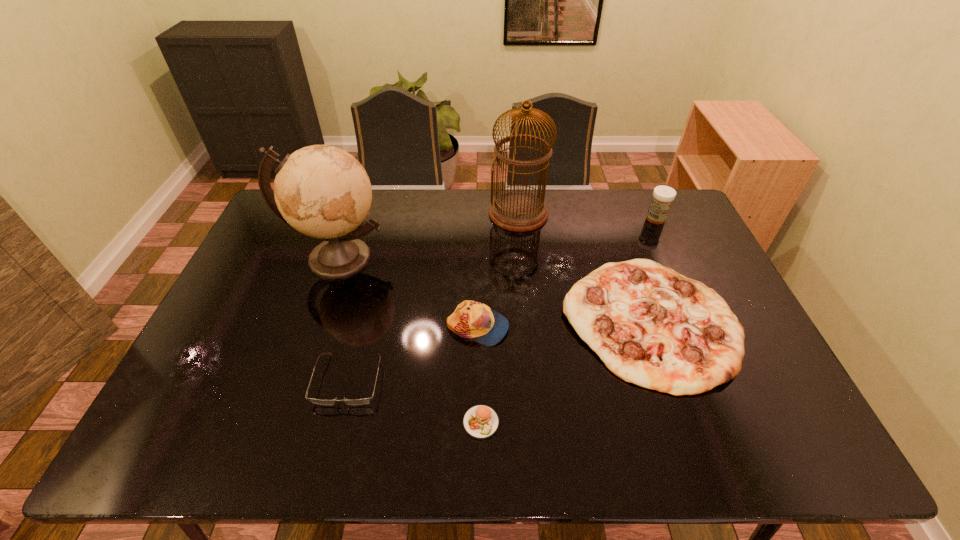
You are a GUI agent. You are given a task and a screenshot of the screen. Output one action in this format:
    pyautogui.click(x=<x>, y=<y>)
    Task: Click on the vacant space at the far edge of the desktop
    This screenshot has width=960, height=540.
    Given the screenshot: What is the action you would take?
    pyautogui.click(x=440, y=214)

The width and height of the screenshot is (960, 540). I want to click on vacant area at the near edge, so click(x=304, y=434).

Locate an element on the screen. This screenshot has height=540, width=960. vacant space at the left edge of the desktop is located at coordinates (249, 354).

This screenshot has width=960, height=540. In order to click on free space at the right edge in this screenshot , I will do `click(669, 268)`.

In the image, there is a desktop. Identify the location of free space at the near left corner. This screenshot has height=540, width=960. (150, 440).

This screenshot has height=540, width=960. Find the location of `vacant point at the far right corner`. vacant point at the far right corner is located at coordinates (638, 191).

Find the location of `free space at the near right corner of the desktop`. free space at the near right corner of the desktop is located at coordinates (777, 440).

At what (x,y) coordinates should I click in order to perform the action: click on empty space between the spectacles and the fifth tallest object. Please return your answer as a coordinate pair (x, y). This screenshot has width=960, height=540. Looking at the image, I should click on (499, 350).

Where is `free space between the shortest object and the cap`? The width and height of the screenshot is (960, 540). free space between the shortest object and the cap is located at coordinates (479, 375).

The height and width of the screenshot is (540, 960). I want to click on free space that is in between the second shortest object and the shortest object, so click(415, 401).